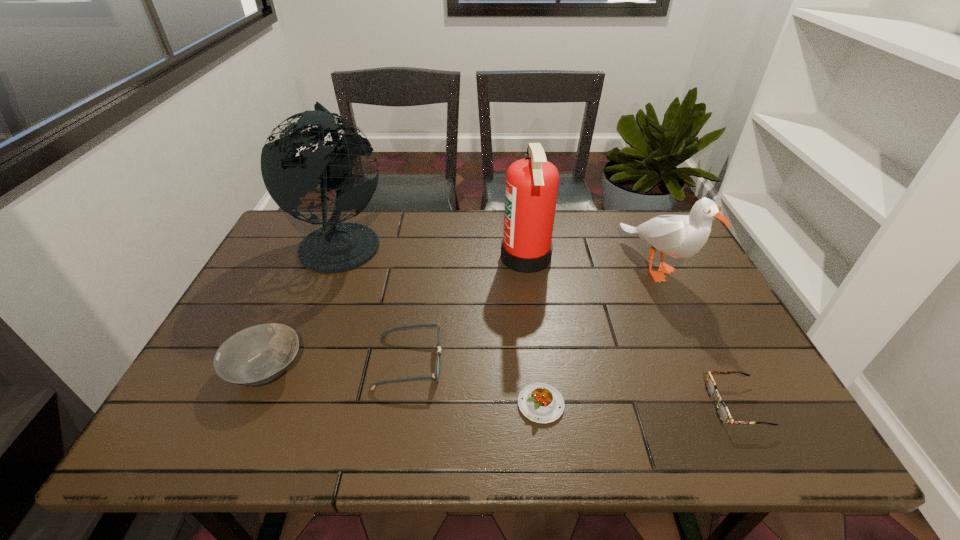
Locate an element on the screen. The image size is (960, 540). object that is positioned at the near right corner is located at coordinates (723, 413).

At what (x,y) coordinates should I click in order to perform the action: click on free region at the far edge. Please return your answer as a coordinate pair (x, y). The height and width of the screenshot is (540, 960). Looking at the image, I should click on (502, 233).

At what (x,y) coordinates should I click in order to perform the action: click on free region at the near edge. Please return your answer as a coordinate pair (x, y). This screenshot has height=540, width=960. Looking at the image, I should click on (256, 445).

Where is `free space at the left edge of the desktop`? The image size is (960, 540). free space at the left edge of the desktop is located at coordinates (207, 356).

You are a GUI agent. You are given a task and a screenshot of the screen. Output one action in this format:
    pyautogui.click(x=<x>, y=<y>)
    Task: Click on the free space at the right edge
    
    Given the screenshot: What is the action you would take?
    pyautogui.click(x=731, y=377)

Identify the location of vacant space at the near left corner of the desktop. (181, 428).

Where is `free space at the far right corner of the desktop`? This screenshot has width=960, height=540. free space at the far right corner of the desktop is located at coordinates tap(645, 249).

Where is `empty space that is in between the shorter spectacles and the taller spectacles`? Image resolution: width=960 pixels, height=540 pixels. empty space that is in between the shorter spectacles and the taller spectacles is located at coordinates (572, 383).

This screenshot has height=540, width=960. I want to click on free space that is in between the pudding and the third object from left to right, so click(475, 383).

Image resolution: width=960 pixels, height=540 pixels. I want to click on vacant region between the shorter spectacles and the globe, so click(x=539, y=323).